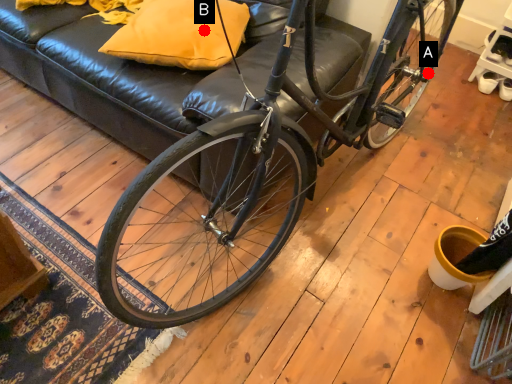
Question: Two points are circled on the image, labeled by A and B beside each circle. Which point is farther to the camera?

Choices:
 (A) A is further
 (B) B is further

Answer: (A)